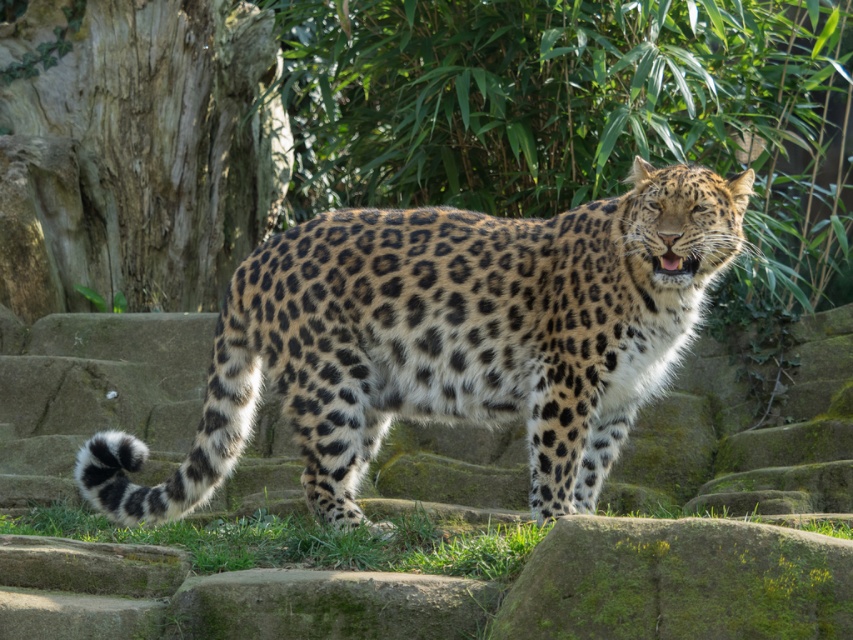
Question: Can you confirm if spotted fur leopard at center is bigger than green grass at lower center?

Choices:
 (A) yes
 (B) no

Answer: (A)

Question: Considering the relative positions of spotted fur leopard at center and green grass at lower center in the image provided, where is spotted fur leopard at center located with respect to green grass at lower center?

Choices:
 (A) left
 (B) right

Answer: (B)

Question: Is spotted fur leopard at center smaller than green grass at lower center?

Choices:
 (A) yes
 (B) no

Answer: (B)

Question: Which of the following is the closest to the observer?

Choices:
 (A) (608, 369)
 (B) (409, 518)

Answer: (A)